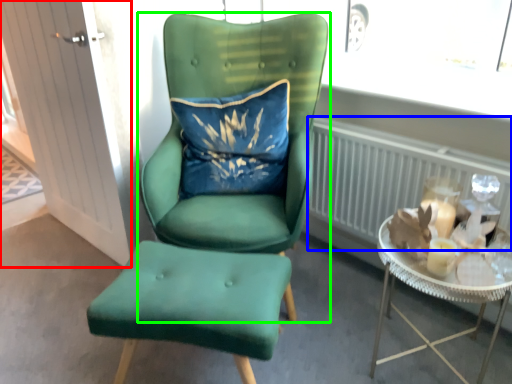
Question: Which object is positioned closest to glass door (highlighted by a red box)? Select from radiator (highlighted by a blue box) and chair (highlighted by a green box).

Choices:
 (A) radiator
 (B) chair

Answer: (B)